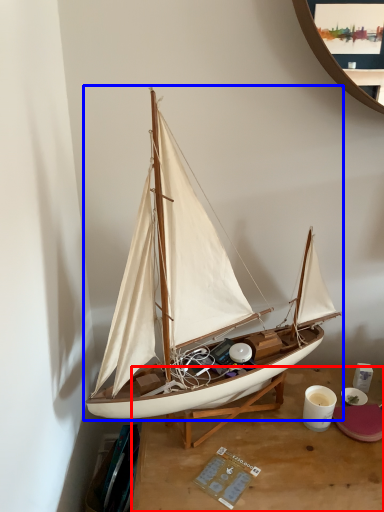
Question: Which object appears farthest to the camera in this image, desk (highlighted by a red box) or boat (highlighted by a blue box)?

Choices:
 (A) desk
 (B) boat

Answer: (A)